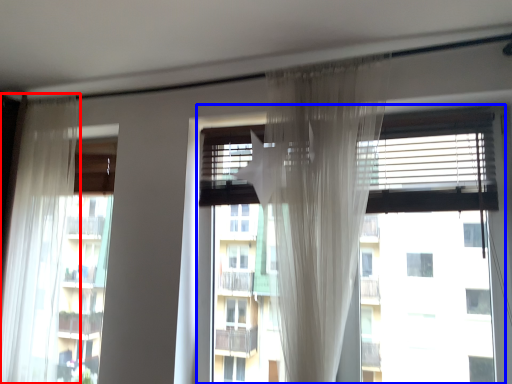
Question: Which point is closer to the camera, curtain (highlighted by a red box) or window (highlighted by a blue box)?

Choices:
 (A) curtain
 (B) window

Answer: (B)